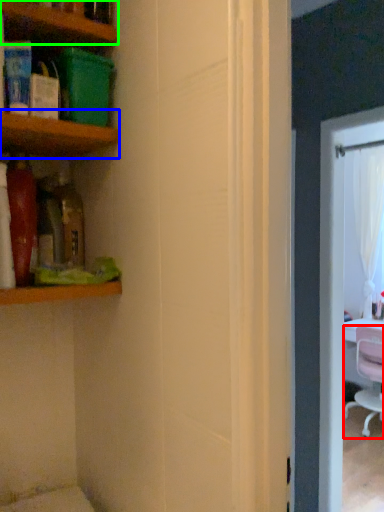
Question: Which object is positioned closest to chair (highlighted by a red box)? Select from shelf (highlighted by a blue box) and shelf (highlighted by a green box).

Choices:
 (A) shelf
 (B) shelf

Answer: (A)